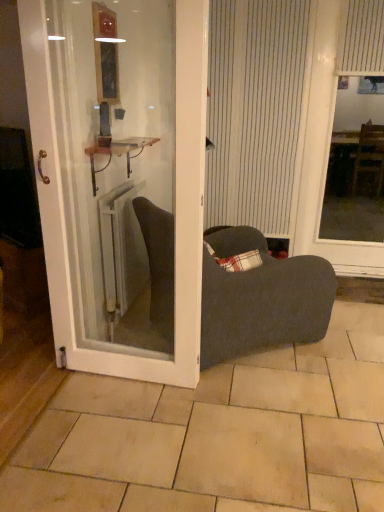
Question: Is metallic copper cabinet at center closer to camera compared to white glossy door at center?

Choices:
 (A) no
 (B) yes

Answer: (A)

Question: Can you confirm if metallic copper cabinet at center is shorter than white glossy door at center?

Choices:
 (A) yes
 (B) no

Answer: (A)

Question: Is metallic copper cabinet at center at the left side of white glossy door at center?

Choices:
 (A) no
 (B) yes

Answer: (B)

Question: Is metallic copper cabinet at center oriented away from white glossy door at center?

Choices:
 (A) no
 (B) yes

Answer: (A)

Question: From a real-world perspective, is metallic copper cabinet at center on white glossy door at center?

Choices:
 (A) yes
 (B) no

Answer: (A)

Question: In the image, is white striped curtain at center, placed as the 2th curtain when sorted from right to left, on the left side or the right side of white metallic radiator at center?

Choices:
 (A) left
 (B) right

Answer: (B)

Question: In terms of width, does white striped curtain at center, placed as the 2th curtain when sorted from right to left, look wider or thinner when compared to white metallic radiator at center?

Choices:
 (A) wide
 (B) thin

Answer: (B)

Question: From a real-world perspective, relative to white metallic radiator at center, is white striped curtain at center, which ranks as the first curtain in left-to-right order, vertically above or below?

Choices:
 (A) above
 (B) below

Answer: (A)

Question: In terms of height, does white striped curtain at center, which ranks as the first curtain in left-to-right order, look taller or shorter compared to white metallic radiator at center?

Choices:
 (A) tall
 (B) short

Answer: (A)

Question: From the image's perspective, relative to beige tile at center, is white striped curtain at upper right, acting as the first curtain starting from the right, above or below?

Choices:
 (A) above
 (B) below

Answer: (A)

Question: Is white striped curtain at upper right, acting as the first curtain starting from the right, inside the boundaries of beige tile at center, or outside?

Choices:
 (A) inside
 (B) outside

Answer: (B)

Question: Is point (364, 70) positioned closer to the camera than point (74, 496)?

Choices:
 (A) closer
 (B) farther

Answer: (B)

Question: From a real-world perspective, is white striped curtain at upper right, arranged as the second curtain when viewed from the left, above or below beige tile at center?

Choices:
 (A) above
 (B) below

Answer: (A)

Question: Is white striped window screen at right wider or thinner than metallic copper cabinet at center?

Choices:
 (A) wide
 (B) thin

Answer: (B)

Question: From a real-world perspective, is white striped window screen at right above or below metallic copper cabinet at center?

Choices:
 (A) below
 (B) above

Answer: (B)